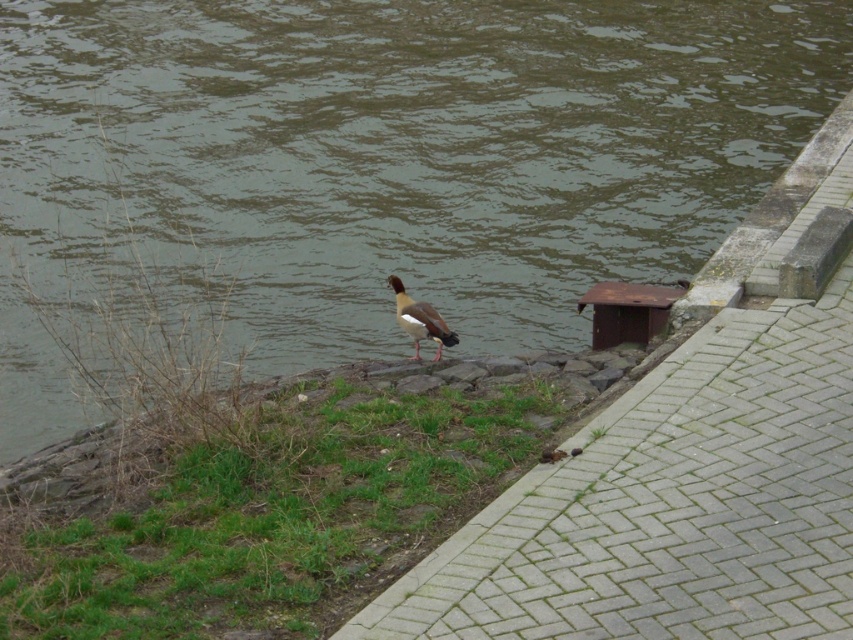
Can you confirm if brown water at center is taller than brown feathered duck at center?

Yes, brown water at center is taller than brown feathered duck at center.

Does brown water at center appear under brown feathered duck at center?

No, brown water at center is not below brown feathered duck at center.

Is point (274, 273) closer to viewer compared to point (402, 323)?

No, (274, 273) is behind (402, 323).

Identify the location of brown water at center. (387, 161).

Is brown water at center thinner than green grass at center?

No.

Between brown water at center and green grass at center, which one appears on the right side from the viewer's perspective?

Positioned to the right is green grass at center.

This screenshot has height=640, width=853. Find the location of `brown water at center`. brown water at center is located at coordinates (387, 161).

Which is above, green grass at center or brown feathered duck at center?

brown feathered duck at center

The width and height of the screenshot is (853, 640). What do you see at coordinates (276, 518) in the screenshot?
I see `green grass at center` at bounding box center [276, 518].

At what (x,y) coordinates should I click in order to perform the action: click on green grass at center. Please return your answer as a coordinate pair (x, y). Looking at the image, I should click on (276, 518).